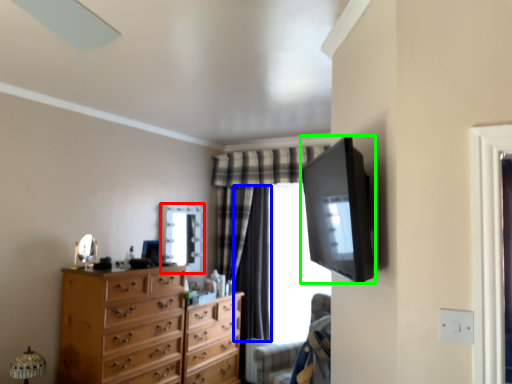
Question: Which object is positioned farthest from mirror (highlighted by a red box)? Select from curtain (highlighted by a blue box) and television (highlighted by a green box).

Choices:
 (A) curtain
 (B) television

Answer: (B)